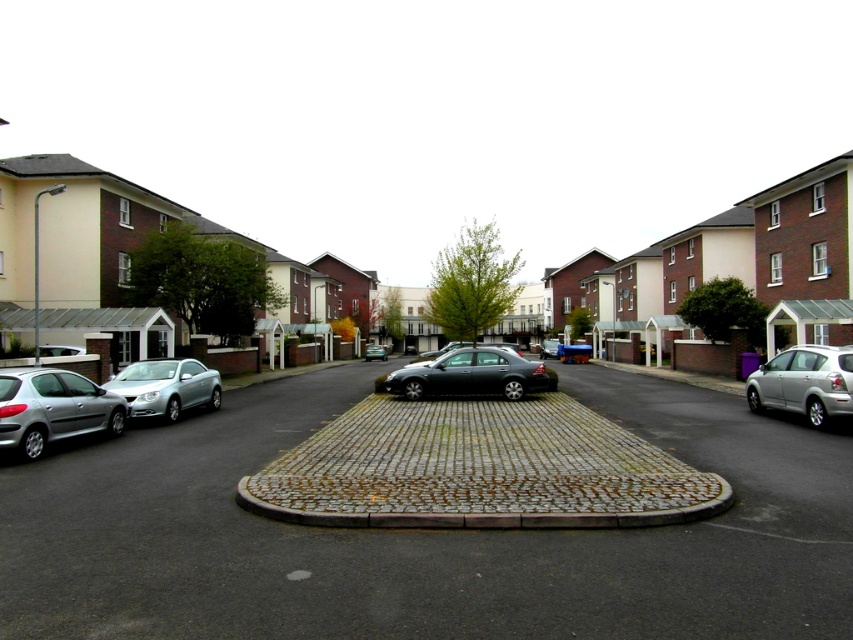
Question: Considering the real-world distances, which object is closest to the silver metallic hatchback at right?

Choices:
 (A) silver metallic hatchback at left
 (B) shiny black sedan at center
 (C) dark gray metallic car at center
 (D) silver metallic car at left

Answer: (B)

Question: Can you confirm if silver metallic hatchback at right is positioned above dark gray metallic car at center?

Choices:
 (A) no
 (B) yes

Answer: (B)

Question: Which point is closer to the camera?

Choices:
 (A) [460, 472]
 (B) [165, 371]

Answer: (A)

Question: Is silver metallic hatchback at right to the right of shiny black sedan at center from the viewer's perspective?

Choices:
 (A) yes
 (B) no

Answer: (A)

Question: Which object is the farthest from the silver metallic hatchback at left?

Choices:
 (A) shiny black sedan at center
 (B) silver metallic hatchback at right
 (C) dark gray metallic car at center
 (D) stone paved curb at center

Answer: (C)

Question: Is the position of silver metallic hatchback at left less distant than that of silver metallic car at left?

Choices:
 (A) yes
 (B) no

Answer: (A)